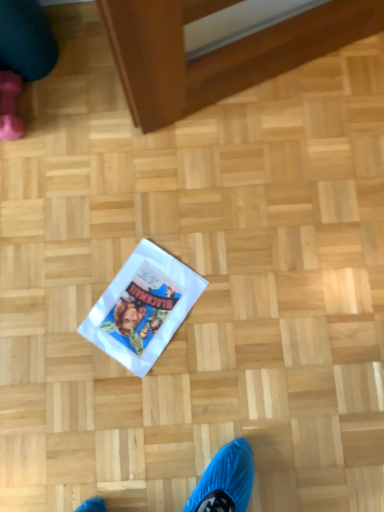
What are the coordinates of `vacant space to the left of white paper flyer at center` in the screenshot? It's located at (61, 314).